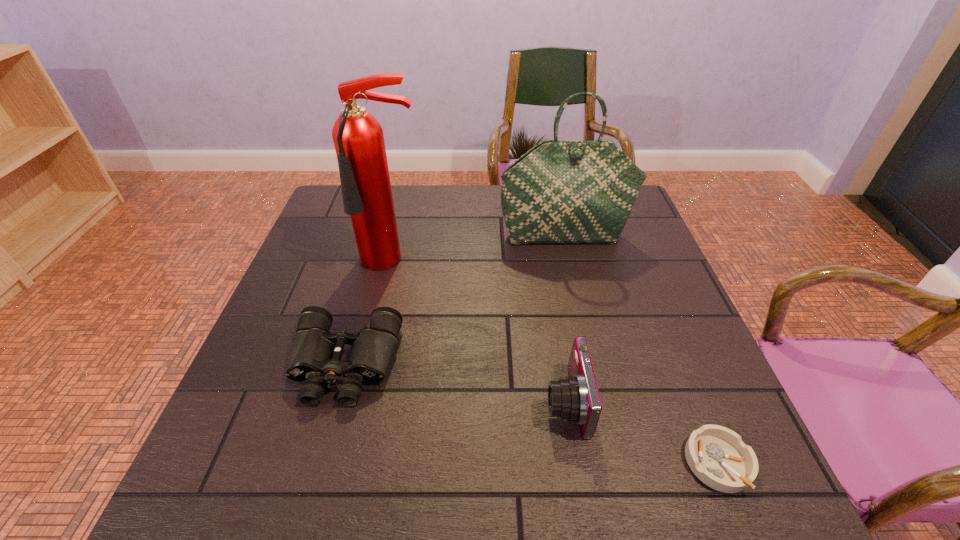
Locate an element on the screen. vacant region located 0.170m through the eyepieces of the binoculars is located at coordinates (307, 498).

Locate an element on the screen. vacant space located on the back of the shortest object is located at coordinates (696, 409).

You are a GUI agent. You are given a task and a screenshot of the screen. Output one action in this format:
    pyautogui.click(x=<x>, y=<y>)
    Task: Click on the object that is positioned at the far edge
    
    Given the screenshot: What is the action you would take?
    pyautogui.click(x=559, y=192)

Find the location of a particular element. object that is positioned at the near edge is located at coordinates coord(718,457).

The image size is (960, 540). In order to click on object at the left edge in this screenshot , I will do `click(315, 355)`.

Locate an element on the screen. tote bag at the right edge is located at coordinates (559, 192).

Find the location of a particular element. The height and width of the screenshot is (540, 960). ashtray at the right edge is located at coordinates (718, 457).

Where is `object that is positioned at the far right corner`? The image size is (960, 540). object that is positioned at the far right corner is located at coordinates (559, 192).

I want to click on object at the near right corner, so click(x=718, y=457).

At what (x,y) coordinates should I click in order to perform the action: click on free region at the far edge of the desktop. Please return your answer as a coordinate pair (x, y). This screenshot has width=960, height=540. Looking at the image, I should click on pyautogui.click(x=439, y=218).